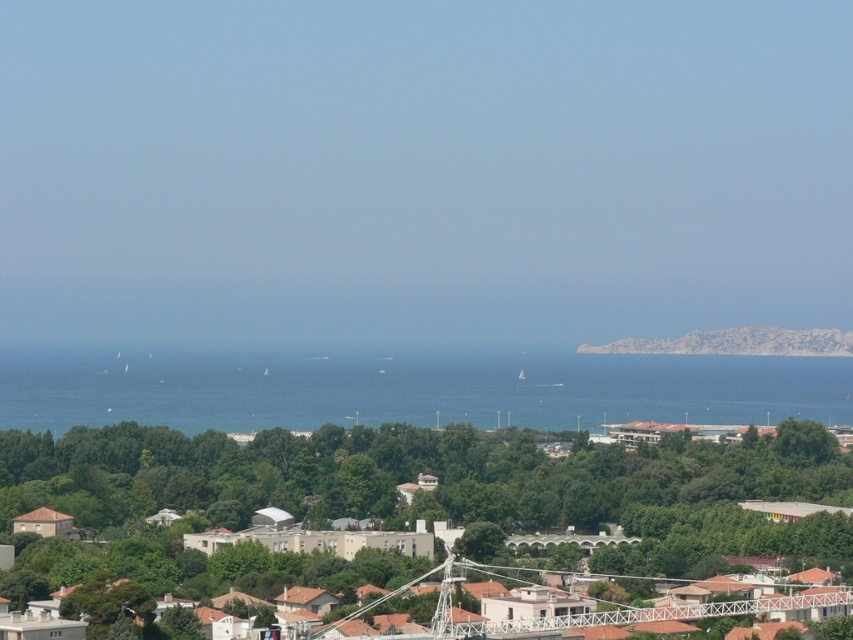
You are standing on a cliff overlooking the coastal area. You see the blue water at center and the rocky cliff at right. Which object is positioned to the left of the other?

The blue water at center is positioned to the left of the rocky cliff at right.

You are a drone operator trying to capture aerial footage of the coastal area. You have two points marked on your map, point (619, 556) and point (706, 394). According to the scene, which point is closer to the camera?

Point (619, 556) is in front of point (706, 394), so it is closer to the camera.